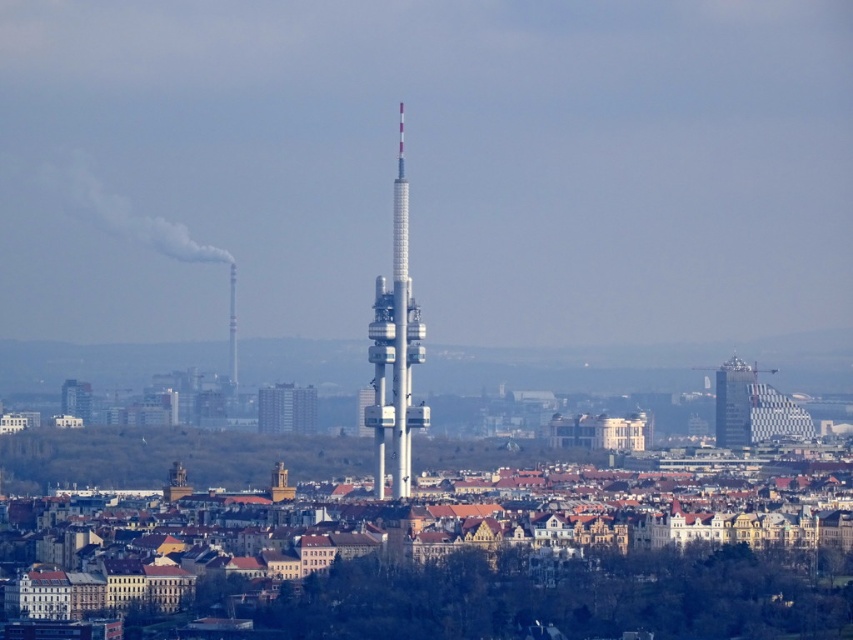
Question: Is white metallic tower at center further to the viewer compared to glassy silver skyscraper at right?

Choices:
 (A) no
 (B) yes

Answer: (A)

Question: Is the position of white metallic tower at center less distant than that of glassy silver skyscraper at right?

Choices:
 (A) yes
 (B) no

Answer: (A)

Question: Does white metallic tower at center have a smaller size compared to glassy silver skyscraper at right?

Choices:
 (A) no
 (B) yes

Answer: (A)